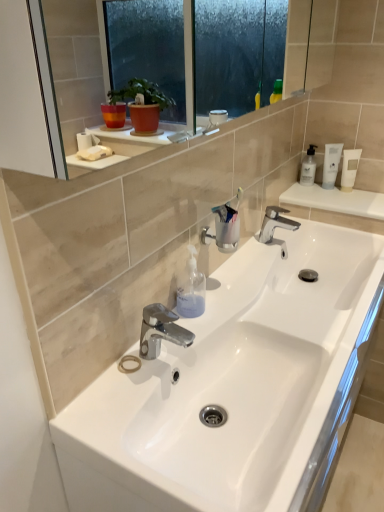
Image resolution: width=384 pixels, height=512 pixels. I want to click on vacant space in front of polished chrome faucet at center, which ranks as the first tap in right-to-left order, so click(259, 264).